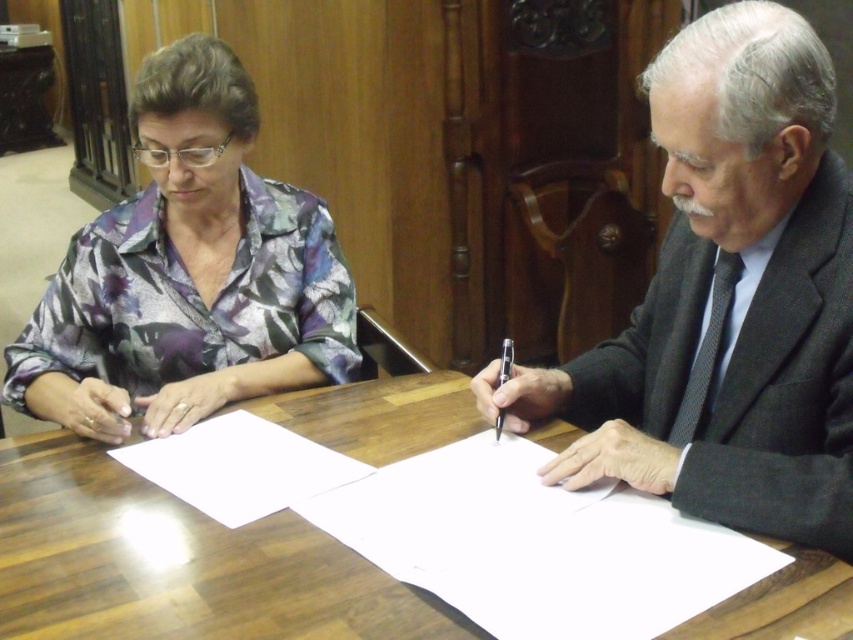
Can you confirm if wooden table at center is positioned above floral fabric blouse at left?

No.

Which is behind, point (426, 596) or point (250, 225)?

Point (250, 225)

Identify the location of wooden table at center. (177, 563).

Is the position of dark gray suit at center more distant than that of black plastic pen at center?

That is False.

Identify the location of dark gray suit at center. The height and width of the screenshot is (640, 853). (728, 298).

Who is shorter, wooden table at center or black plastic pen at center?

black plastic pen at center is shorter.

From the picture: Is the position of wooden table at center less distant than that of black plastic pen at center?

That is True.

Is point (426, 612) farther from viewer compared to point (514, 352)?

No, it is not.

What are the coordinates of `wooden table at center` in the screenshot? It's located at (177, 563).